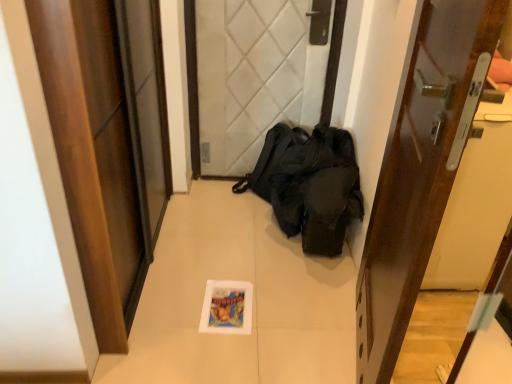
The width and height of the screenshot is (512, 384). Describe the element at coordinates (257, 74) in the screenshot. I see `white quilted fabric at center, which is the second door in left-to-right order` at that location.

This screenshot has width=512, height=384. In order to click on white quilted fabric at center, which is the second door in left-to-right order in this screenshot , I will do `click(257, 74)`.

Looking at this image, based on their positions, is wooden door at left, which appears as the 3th door when viewed from the right, located to the left or right of wooden glossy door at right, the 1th door positioned from the right?

wooden door at left, which appears as the 3th door when viewed from the right, is to the left of wooden glossy door at right, the 1th door positioned from the right.

In the image, there is a wooden door at left, placed as the first door when sorted from left to right. Where is `door below it (from the image's perspective)`? door below it (from the image's perspective) is located at coordinates (421, 170).

Which is behind, point (122, 329) or point (403, 270)?

Positioned behind is point (122, 329).

From a real-world perspective, relative to wooden glossy door at right, the 1th door positioned from the right, is white quilted fabric at center, the second door positioned from the right, vertically above or below?

Clearly, from a real-world perspective, white quilted fabric at center, the second door positioned from the right, is below wooden glossy door at right, the 1th door positioned from the right.

Is point (226, 80) positioned after point (367, 329)?

Yes, it is.

Would you say white quilted fabric at center, which is the second door in left-to-right order, is outside wooden glossy door at right, the 1th door positioned from the right?

white quilted fabric at center, which is the second door in left-to-right order, is positioned outside wooden glossy door at right, the 1th door positioned from the right.

Considering the relative sizes of white quilted fabric at center, the second door positioned from the right, and wooden glossy door at right, arranged as the third door when viewed from the left, in the image provided, is white quilted fabric at center, the second door positioned from the right, wider than wooden glossy door at right, arranged as the third door when viewed from the left,?

Yes, white quilted fabric at center, the second door positioned from the right, is wider than wooden glossy door at right, arranged as the third door when viewed from the left.

Does wooden door at left, placed as the first door when sorted from left to right, have a larger size compared to white quilted fabric at center, the second door positioned from the right?

Yes.

Is wooden door at left, placed as the first door when sorted from left to right, not inside white quilted fabric at center, the second door positioned from the right?

wooden door at left, placed as the first door when sorted from left to right, is positioned outside white quilted fabric at center, the second door positioned from the right.

Is wooden door at left, placed as the first door when sorted from left to right, shorter than white quilted fabric at center, which is the second door in left-to-right order?

In fact, wooden door at left, placed as the first door when sorted from left to right, may be taller than white quilted fabric at center, which is the second door in left-to-right order.

Is wooden door at left, which appears as the 3th door when viewed from the right, oriented away from white quilted fabric at center, the second door positioned from the right?

No, wooden door at left, which appears as the 3th door when viewed from the right, is not facing away from white quilted fabric at center, the second door positioned from the right.

From a real-world perspective, which is physically below, white quilted fabric at center, which is the second door in left-to-right order, or wooden door at left, placed as the first door when sorted from left to right?

From a 3D spatial view, white quilted fabric at center, which is the second door in left-to-right order, is below.

Which object is positioned more to the left, white quilted fabric at center, the second door positioned from the right, or wooden door at left, placed as the first door when sorted from left to right?

wooden door at left, placed as the first door when sorted from left to right.

From the image's perspective, which object appears higher, white quilted fabric at center, which is the second door in left-to-right order, or wooden door at left, which appears as the 3th door when viewed from the right?

white quilted fabric at center, which is the second door in left-to-right order, appears higher in the image.

From a real-world perspective, between wooden glossy door at right, arranged as the third door when viewed from the left, and wooden door at left, which appears as the 3th door when viewed from the right, who is vertically higher?

wooden glossy door at right, arranged as the third door when viewed from the left, is physically above.

Who is bigger, wooden glossy door at right, arranged as the third door when viewed from the left, or wooden door at left, placed as the first door when sorted from left to right?

wooden door at left, placed as the first door when sorted from left to right.

Can you confirm if wooden glossy door at right, the 1th door positioned from the right, is wider than wooden door at left, which appears as the 3th door when viewed from the right?

In fact, wooden glossy door at right, the 1th door positioned from the right, might be narrower than wooden door at left, which appears as the 3th door when viewed from the right.

Find the location of a particular element. The image size is (512, 384). the 2nd door positioned above the white quilted fabric at center, the second door positioned from the right (from a real-world perspective) is located at coordinates (421, 170).

Does point (474, 104) appear closer or farther from the camera than point (188, 43)?

Point (474, 104) is closer to the camera than point (188, 43).

Can you confirm if wooden glossy door at right, the 1th door positioned from the right, is thinner than white quilted fabric at center, the second door positioned from the right?

Correct, the width of wooden glossy door at right, the 1th door positioned from the right, is less than that of white quilted fabric at center, the second door positioned from the right.

From a real-world perspective, is wooden glossy door at right, arranged as the third door when viewed from the left, under white quilted fabric at center, the second door positioned from the right?

No, from a real-world perspective, wooden glossy door at right, arranged as the third door when viewed from the left, is not under white quilted fabric at center, the second door positioned from the right.

Where is `door that appears below the wooden door at left, which appears as the 3th door when viewed from the right (from the image's perspective)`? door that appears below the wooden door at left, which appears as the 3th door when viewed from the right (from the image's perspective) is located at coordinates (421, 170).

From a real-world perspective, count 2nd doors downward from the wooden glossy door at right, arranged as the third door when viewed from the left, and point to it. Please provide its 2D coordinates.

[(257, 74)]

Consider the image. Estimate the real-world distances between objects in this image. Which object is further from wooden door at left, placed as the first door when sorted from left to right, white quilted fabric at center, which is the second door in left-to-right order, or wooden glossy door at right, the 1th door positioned from the right?

white quilted fabric at center, which is the second door in left-to-right order, is further to wooden door at left, placed as the first door when sorted from left to right.

Which object lies nearer to the anchor point white quilted fabric at center, the second door positioned from the right, wooden door at left, which appears as the 3th door when viewed from the right, or wooden glossy door at right, arranged as the third door when viewed from the left?

The object closer to white quilted fabric at center, the second door positioned from the right, is wooden door at left, which appears as the 3th door when viewed from the right.

When comparing their distances from wooden glossy door at right, the 1th door positioned from the right, does white quilted fabric at center, the second door positioned from the right, or wooden door at left, placed as the first door when sorted from left to right, seem further?

white quilted fabric at center, the second door positioned from the right, is further to wooden glossy door at right, the 1th door positioned from the right.

When comparing their distances from wooden door at left, which appears as the 3th door when viewed from the right, does wooden glossy door at right, arranged as the third door when viewed from the left, or white quilted fabric at center, which is the second door in left-to-right order, seem closer?

wooden glossy door at right, arranged as the third door when viewed from the left, lies closer to wooden door at left, which appears as the 3th door when viewed from the right, than the other object.

When comparing their distances from wooden glossy door at right, the 1th door positioned from the right, does wooden door at left, placed as the first door when sorted from left to right, or white quilted fabric at center, which is the second door in left-to-right order, seem further?

white quilted fabric at center, which is the second door in left-to-right order, is positioned further to the anchor wooden glossy door at right, the 1th door positioned from the right.

Considering their positions, is wooden glossy door at right, arranged as the third door when viewed from the left, positioned further to white quilted fabric at center, which is the second door in left-to-right order, than wooden door at left, placed as the first door when sorted from left to right?

Among the two, wooden glossy door at right, arranged as the third door when viewed from the left, is located further to white quilted fabric at center, which is the second door in left-to-right order.

Where is `door positioned between wooden glossy door at right, the 1th door positioned from the right, and white quilted fabric at center, the second door positioned from the right, from near to far`? The width and height of the screenshot is (512, 384). door positioned between wooden glossy door at right, the 1th door positioned from the right, and white quilted fabric at center, the second door positioned from the right, from near to far is located at coordinates (93, 155).